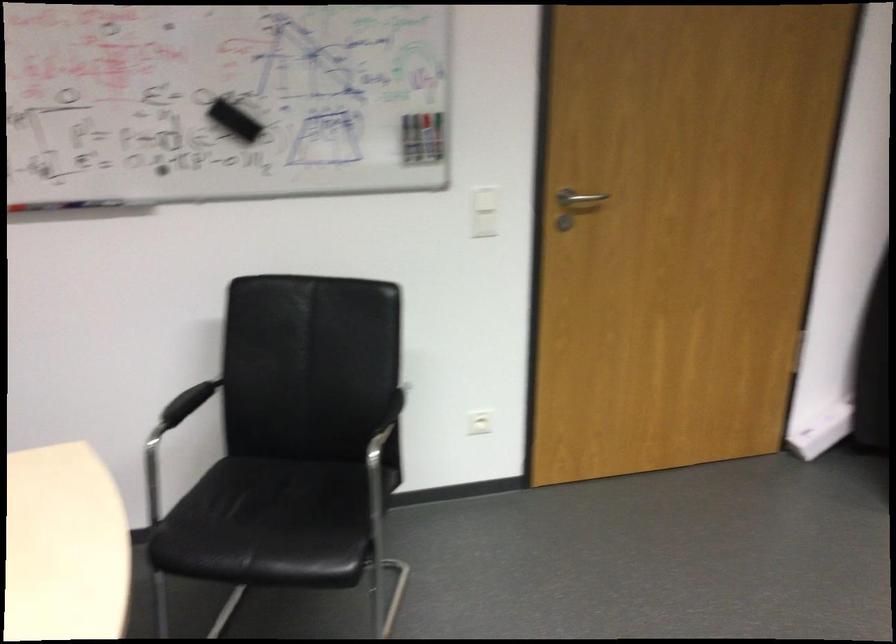
Find where to pull the silver door handle. Please return your answer as a coordinate pair (x, y).

(579, 199)